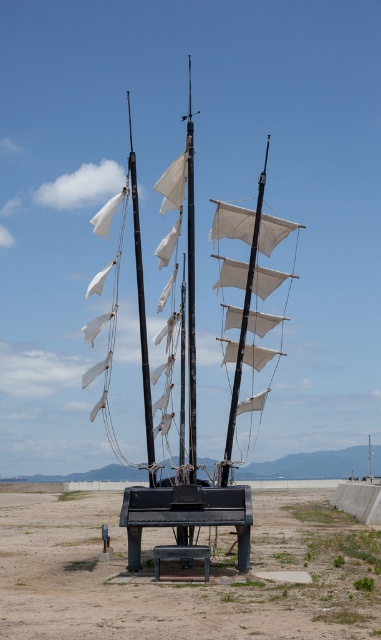
Is metallic matte sailboat at center in front of black matte bench at center?

No, it is behind black matte bench at center.

Is metallic matte sailboat at center below black matte bench at center?

Incorrect, metallic matte sailboat at center is not positioned below black matte bench at center.

Between point (139, 268) and point (244, 513), which one is positioned behind?

Point (139, 268)

The width and height of the screenshot is (381, 640). I want to click on metallic matte sailboat at center, so click(188, 305).

Does dirt field at lower center appear on the right side of black matte bench at center?

Indeed, dirt field at lower center is positioned on the right side of black matte bench at center.

Which of these two, dirt field at lower center or black matte bench at center, stands shorter?

black matte bench at center is shorter.

What do you see at coordinates (182, 580) in the screenshot? I see `dirt field at lower center` at bounding box center [182, 580].

Locate an element on the screen. This screenshot has width=381, height=640. dirt field at lower center is located at coordinates (182, 580).

Can you confirm if dirt field at lower center is smaller than metallic matte sailboat at center?

Yes, dirt field at lower center is smaller than metallic matte sailboat at center.

Is point (372, 570) closer to viewer compared to point (134, 240)?

That is True.

Does point (241, 573) come closer to viewer compared to point (137, 241)?

That is True.

Where is `dirt field at lower center`? The image size is (381, 640). dirt field at lower center is located at coordinates (182, 580).